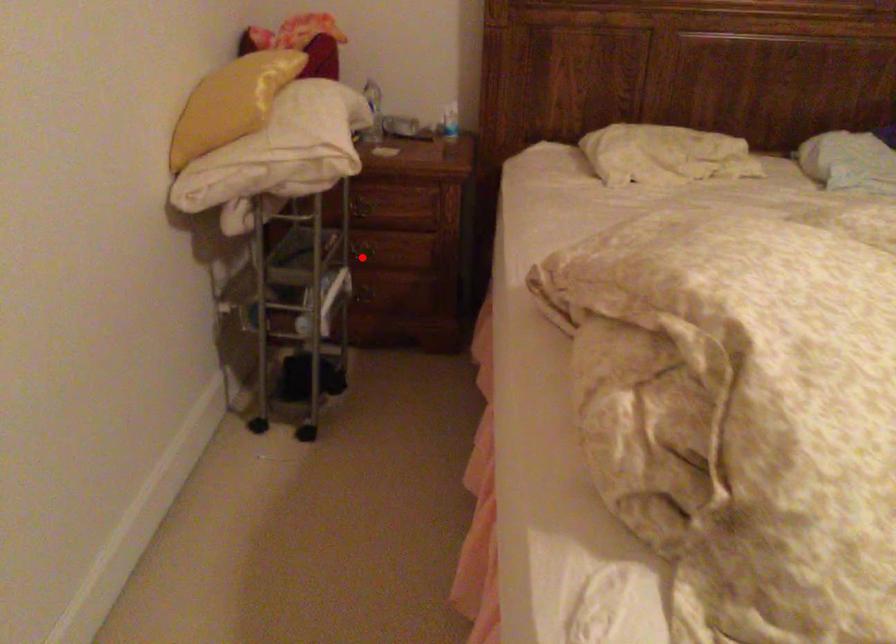
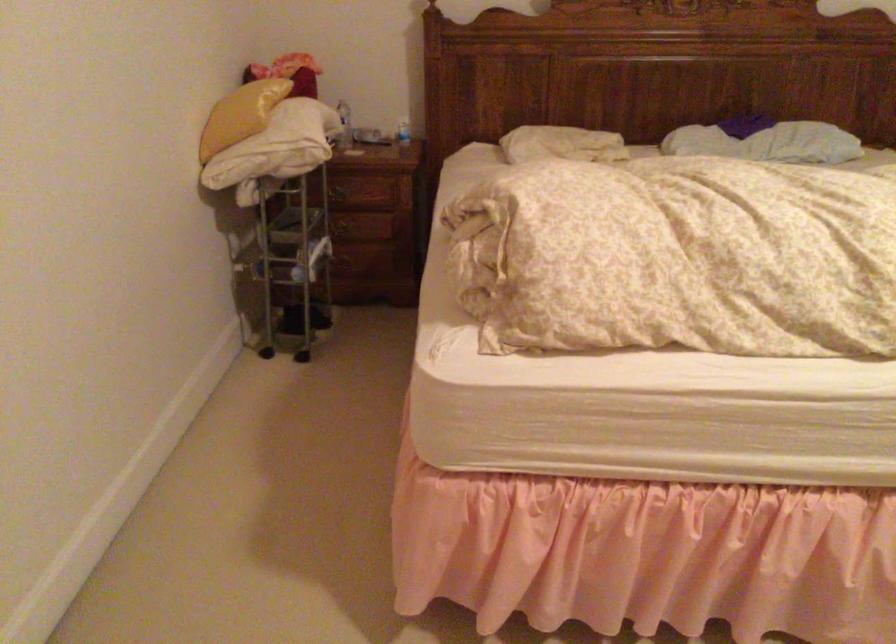
The point at the highlighted location is marked in the first image. Where is the corresponding point in the second image?

(342, 230)